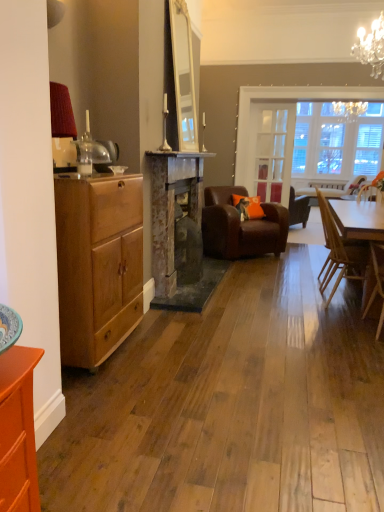
Question: Should I look upward or downward to see matte wood chest of drawers at left?

Choices:
 (A) up
 (B) down

Answer: (B)

Question: Would you say matte wood chest of drawers at left is a long distance from brown leather armchair at center, the first chair in the back-to-front sequence?

Choices:
 (A) yes
 (B) no

Answer: (A)

Question: Is matte wood chest of drawers at left in contact with brown leather armchair at center, which ranks as the 4th chair in front-to-back order?

Choices:
 (A) no
 (B) yes

Answer: (A)

Question: Does matte wood chest of drawers at left turn towards brown leather armchair at center, which ranks as the 4th chair in front-to-back order?

Choices:
 (A) no
 (B) yes

Answer: (A)

Question: Does matte wood chest of drawers at left have a greater height compared to brown leather armchair at center, which ranks as the 4th chair in front-to-back order?

Choices:
 (A) yes
 (B) no

Answer: (A)

Question: Is the depth of matte wood chest of drawers at left less than that of brown leather armchair at center, which ranks as the 4th chair in front-to-back order?

Choices:
 (A) no
 (B) yes

Answer: (B)

Question: Considering the relative sizes of matte wood chest of drawers at left and brown leather armchair at center, the first chair in the back-to-front sequence, in the image provided, is matte wood chest of drawers at left bigger than brown leather armchair at center, the first chair in the back-to-front sequence,?

Choices:
 (A) no
 (B) yes

Answer: (A)

Question: Can you confirm if matte wood chest of drawers at left is bigger than brown leather armchair at center, the 3th chair from the front?

Choices:
 (A) no
 (B) yes

Answer: (A)

Question: Is matte wood chest of drawers at left next to brown leather armchair at center, the 3th chair from the front?

Choices:
 (A) yes
 (B) no

Answer: (B)

Question: Considering the relative positions of matte wood chest of drawers at left and brown leather armchair at center, the 3th chair from the front, in the image provided, is matte wood chest of drawers at left to the left of brown leather armchair at center, the 3th chair from the front, from the viewer's perspective?

Choices:
 (A) no
 (B) yes

Answer: (B)

Question: Is matte wood chest of drawers at left smaller than brown leather armchair at center, the 3th chair from the front?

Choices:
 (A) yes
 (B) no

Answer: (A)

Question: Is matte wood chest of drawers at left oriented away from brown leather armchair at center, which ranks as the 2th chair in back-to-front order?

Choices:
 (A) yes
 (B) no

Answer: (B)

Question: From a real-world perspective, is matte wood chest of drawers at left physically below brown leather armchair at center, the 3th chair from the front?

Choices:
 (A) no
 (B) yes

Answer: (A)

Question: Does light brown wooden chair at right, which is counted as the 4th chair, starting from the back, appear on the right side of matte wood chest of drawers at left?

Choices:
 (A) yes
 (B) no

Answer: (A)